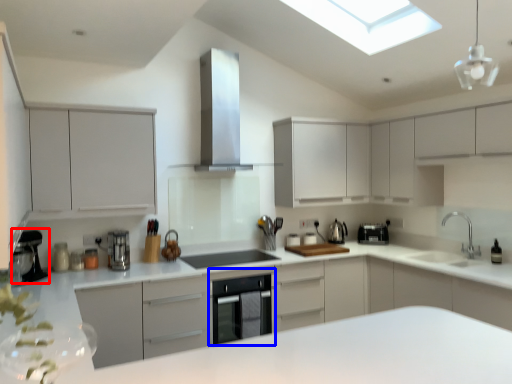
Question: Among these objects, which one is nearest to the camera, coffee machine (highlighted by a red box) or dish washer (highlighted by a blue box)?

Choices:
 (A) coffee machine
 (B) dish washer

Answer: (A)